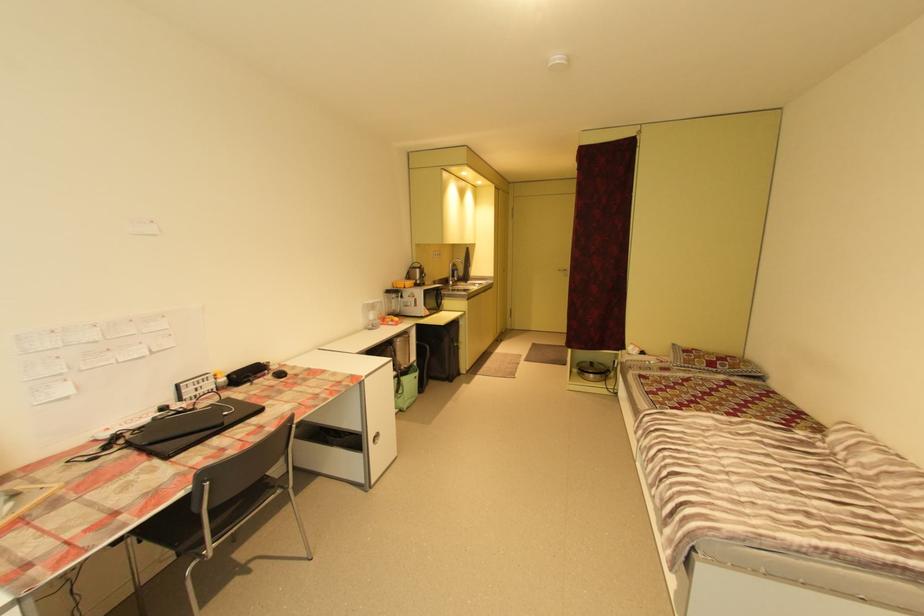
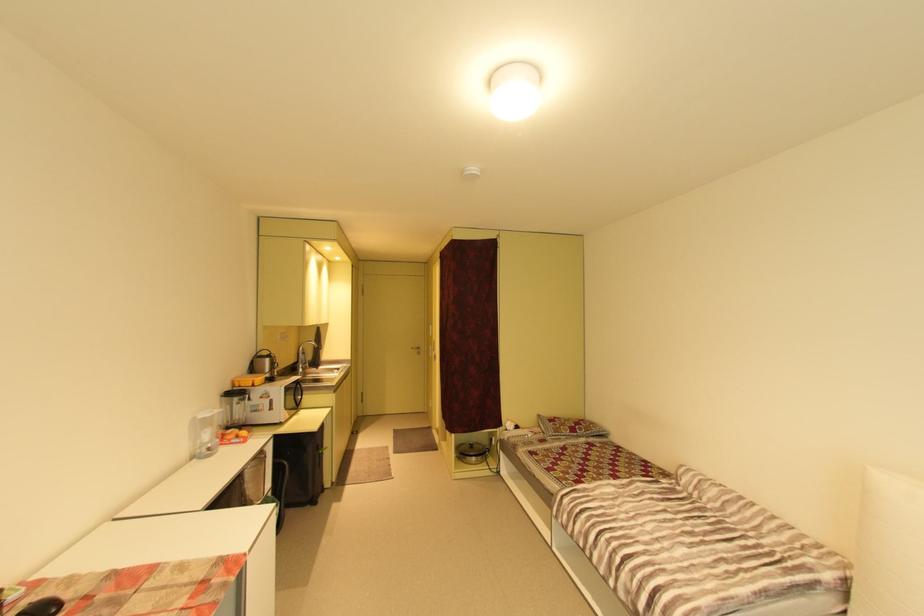
Where in the second image is the point corresponding to pixel 402 284 from the first image?

(246, 381)